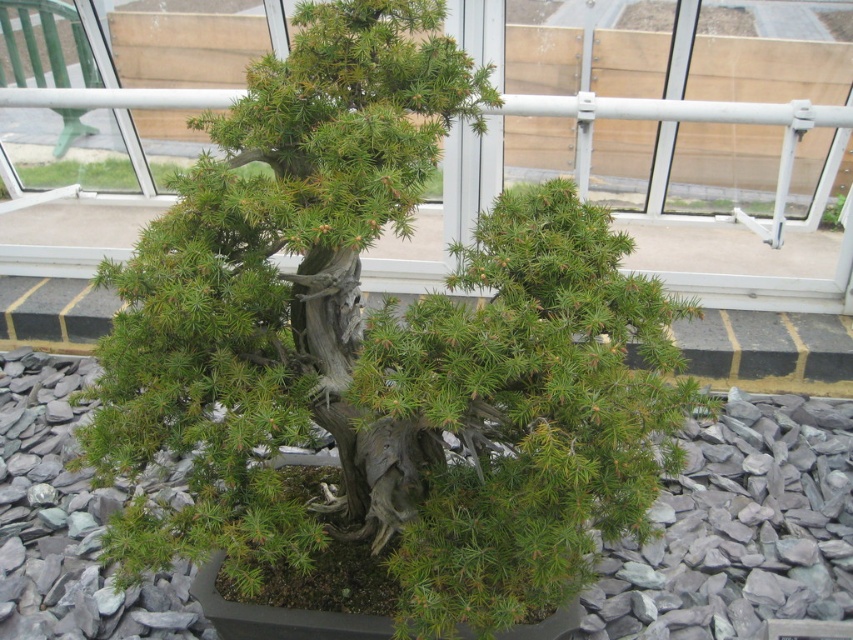
Does gray gravel at center appear over green textured plant at center?

No, gray gravel at center is not above green textured plant at center.

Is gray gravel at center to the right of green textured plant at center from the viewer's perspective?

No, gray gravel at center is not to the right of green textured plant at center.

Measure the distance between point (54, 355) and camera.

They are 2.88 meters apart.

Locate an element on the screen. Image resolution: width=853 pixels, height=640 pixels. gray gravel at center is located at coordinates (740, 529).